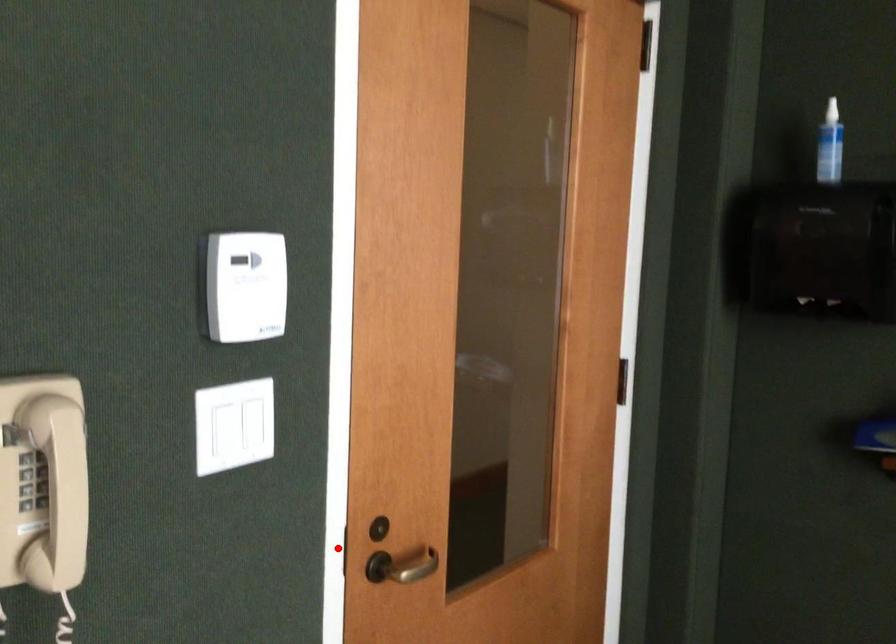
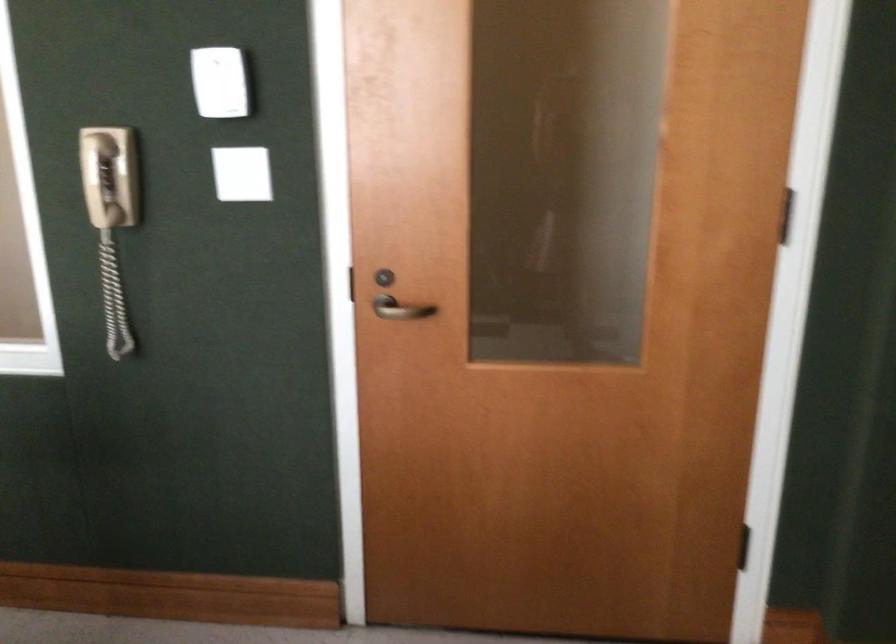
Question: I am providing you with two images of the same scene from different viewpoints. Image1 has a red point marked. In image2, the corresponding 3D location appears at what relative position? Reply with the corresponding letter.

Choices:
 (A) Closer
 (B) Farther

Answer: (B)